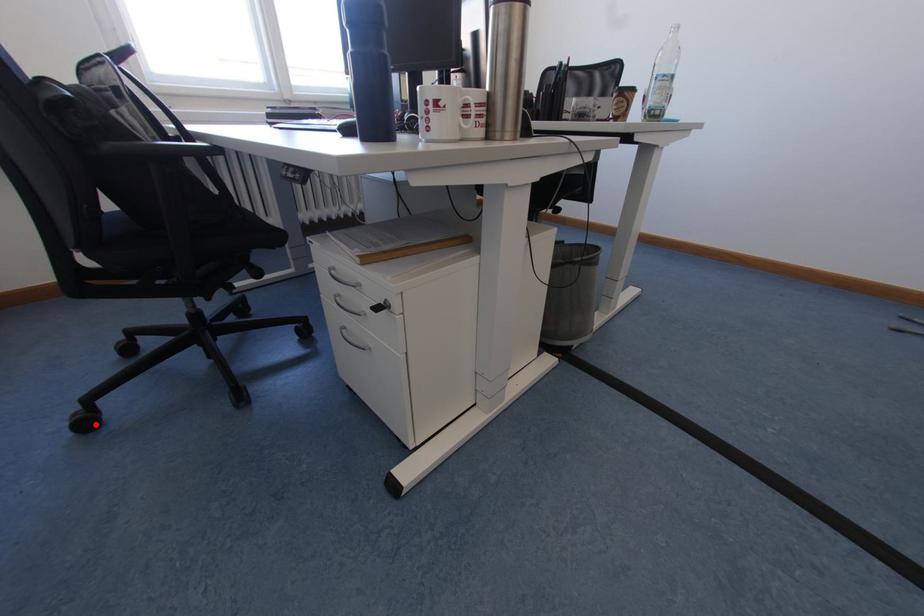
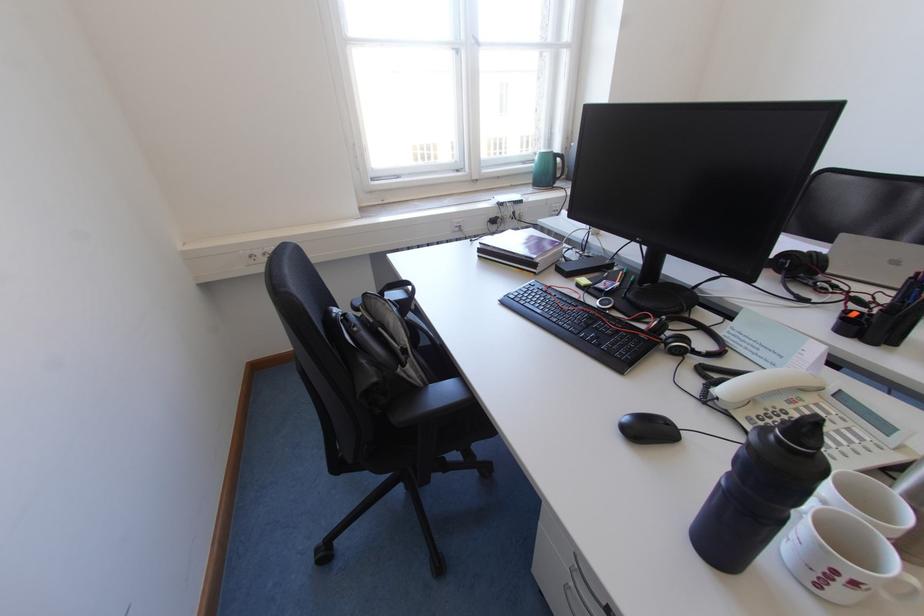
Question: I am providing you with two images of the same scene from different viewpoints. In image1, a red point is highlighted. Considering the same 3D point in image2, which of the following is correct?

Choices:
 (A) It is closer
 (B) It is farther

Answer: (B)